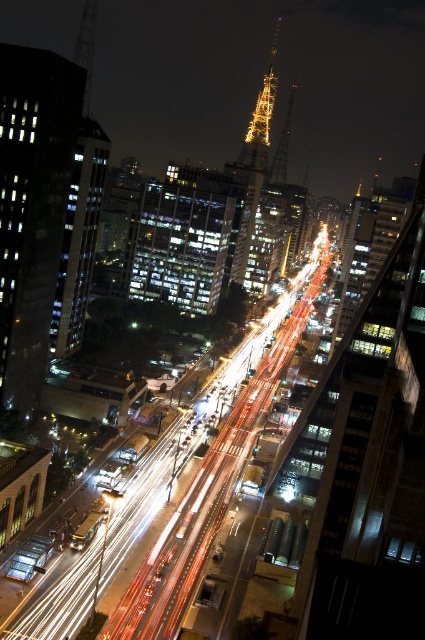
Question: Does glassy reflective building at center come in front of shiny metallic tower at center?

Choices:
 (A) yes
 (B) no

Answer: (A)

Question: Can you confirm if glassy reflective building at center is positioned to the left of shiny metallic tower at center?

Choices:
 (A) yes
 (B) no

Answer: (A)

Question: Among these objects, which one is nearest to the camera?

Choices:
 (A) glassy reflective building at center
 (B) shiny metallic tower at center

Answer: (A)

Question: Which object is farther from the camera taking this photo?

Choices:
 (A) shiny metallic tower at center
 (B) glassy reflective building at center

Answer: (A)

Question: Is glassy reflective building at center smaller than shiny metallic tower at center?

Choices:
 (A) no
 (B) yes

Answer: (B)

Question: Which object appears closest to the camera in this image?

Choices:
 (A) glassy reflective building at center
 (B) shiny metallic tower at center

Answer: (A)